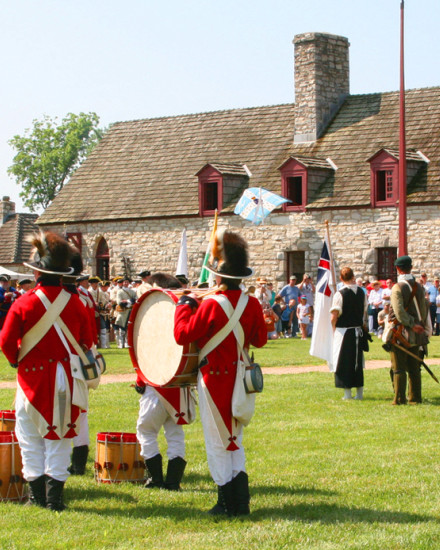
Where is `windows`? This screenshot has height=550, width=440. windows is located at coordinates (383, 183), (293, 187), (209, 190), (385, 261), (101, 260).